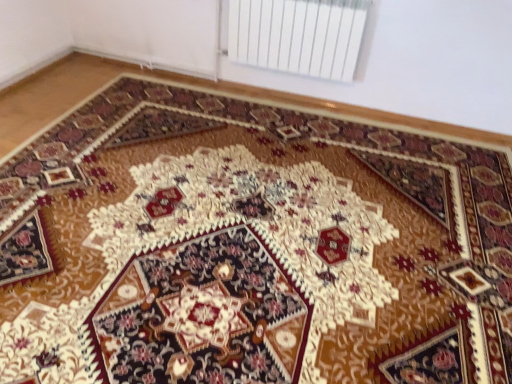
The image size is (512, 384). What do you see at coordinates (262, 96) in the screenshot?
I see `white plastic window at upper center` at bounding box center [262, 96].

Measure the distance between point (31, 93) and camera.

Point (31, 93) and camera are 10.60 feet apart from each other.

Identify the location of white plastic window at upper center. The height and width of the screenshot is (384, 512). (262, 96).

Where is `white plastic window at upper center`? The image size is (512, 384). white plastic window at upper center is located at coordinates (262, 96).